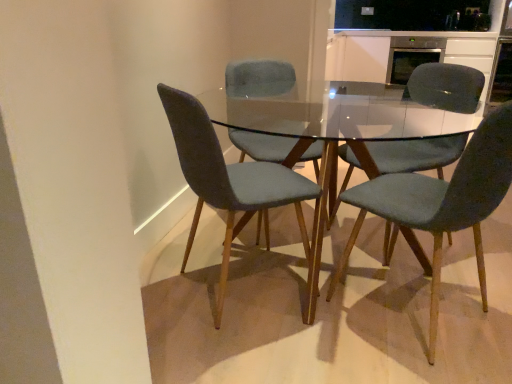
Question: From the image's perspective, would you say stainless steel oven at upper right is shown under velvet grey chair at center, positioned as the 4th chair in right-to-left order?

Choices:
 (A) no
 (B) yes

Answer: (A)

Question: Does stainless steel oven at upper right appear on the left side of velvet grey chair at center, the 1th chair in the left-to-right sequence?

Choices:
 (A) yes
 (B) no

Answer: (B)

Question: From a real-world perspective, is stainless steel oven at upper right physically above velvet grey chair at center, the 1th chair in the left-to-right sequence?

Choices:
 (A) yes
 (B) no

Answer: (A)

Question: Considering the relative sizes of stainless steel oven at upper right and velvet grey chair at center, positioned as the 4th chair in right-to-left order, in the image provided, is stainless steel oven at upper right thinner than velvet grey chair at center, positioned as the 4th chair in right-to-left order,?

Choices:
 (A) yes
 (B) no

Answer: (B)

Question: Considering the relative positions of stainless steel oven at upper right and velvet grey chair at center, positioned as the 4th chair in right-to-left order, in the image provided, is stainless steel oven at upper right in front of velvet grey chair at center, positioned as the 4th chair in right-to-left order,?

Choices:
 (A) no
 (B) yes

Answer: (A)

Question: Is velvet grey chair at center, positioned as the 4th chair in right-to-left order, spatially inside stainless steel oven at upper right, or outside of it?

Choices:
 (A) outside
 (B) inside

Answer: (A)

Question: Is velvet grey chair at center, the 1th chair in the left-to-right sequence, taller or shorter than stainless steel oven at upper right?

Choices:
 (A) short
 (B) tall

Answer: (B)

Question: Is velvet grey chair at center, positioned as the 4th chair in right-to-left order, wider or thinner than stainless steel oven at upper right?

Choices:
 (A) wide
 (B) thin

Answer: (B)

Question: Considering their positions, is velvet grey chair at center, the 1th chair in the left-to-right sequence, located in front of or behind stainless steel oven at upper right?

Choices:
 (A) front
 (B) behind

Answer: (A)

Question: From a real-world perspective, is velvet teal chair at center, which ranks as the 1th chair in right-to-left order, physically located above or below satin white cabinet at upper right?

Choices:
 (A) below
 (B) above

Answer: (A)

Question: In the image, is velvet teal chair at center, which ranks as the 1th chair in right-to-left order, on the left side or the right side of satin white cabinet at upper right?

Choices:
 (A) left
 (B) right

Answer: (A)

Question: In terms of width, does velvet teal chair at center, positioned as the fourth chair in left-to-right order, look wider or thinner when compared to satin white cabinet at upper right?

Choices:
 (A) wide
 (B) thin

Answer: (B)

Question: Choose the correct answer: Is velvet teal chair at center, which ranks as the 1th chair in right-to-left order, inside satin white cabinet at upper right or outside it?

Choices:
 (A) outside
 (B) inside

Answer: (A)

Question: Is velvet teal chair at center, which ranks as the 1th chair in right-to-left order, bigger or smaller than stainless steel oven at upper right?

Choices:
 (A) big
 (B) small

Answer: (B)

Question: Based on their positions, is velvet teal chair at center, which ranks as the 1th chair in right-to-left order, located to the left or right of stainless steel oven at upper right?

Choices:
 (A) right
 (B) left

Answer: (B)